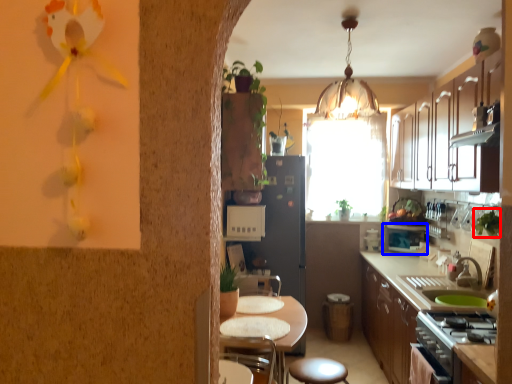
Question: Which point is closer to the camera, plant (highlighted by a red box) or appliance (highlighted by a blue box)?

Choices:
 (A) plant
 (B) appliance

Answer: (A)